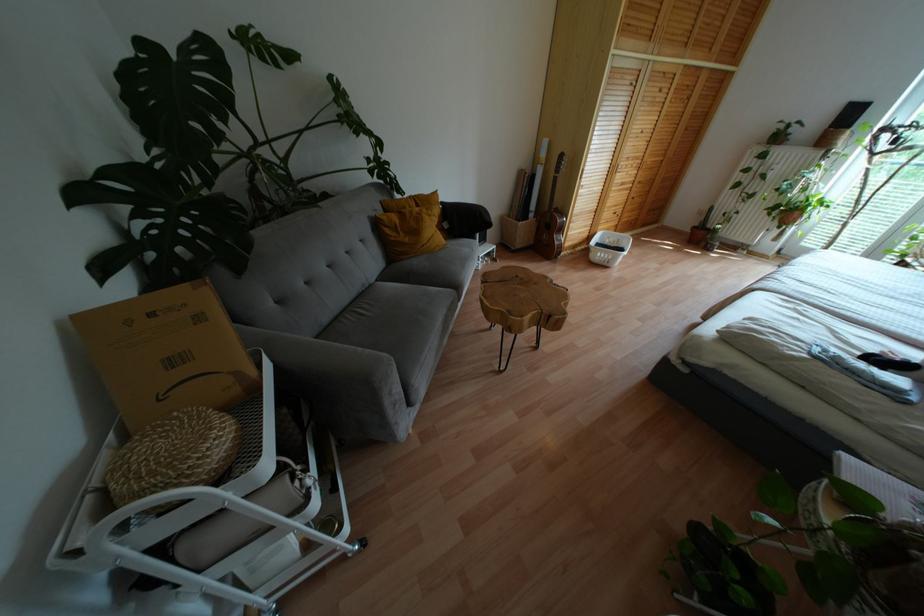
In order to click on sofa sitting surface in this screenshot , I will do `click(399, 320)`.